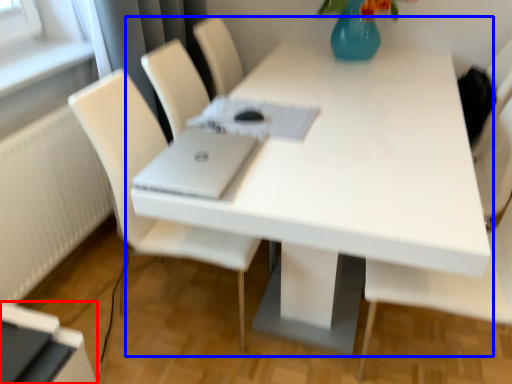
Question: Which object appears closest to the camera in this image, desktop (highlighted by a red box) or table (highlighted by a blue box)?

Choices:
 (A) desktop
 (B) table

Answer: (B)